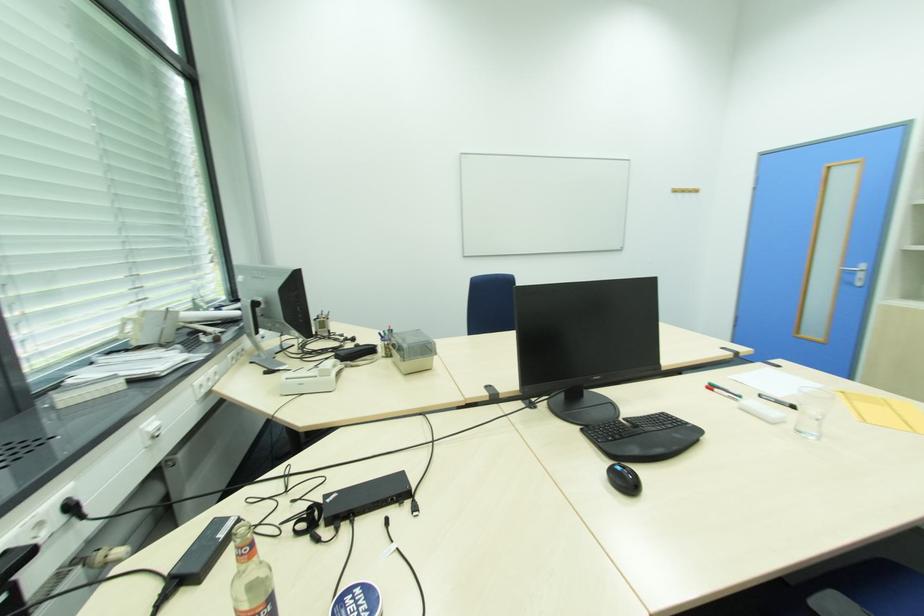
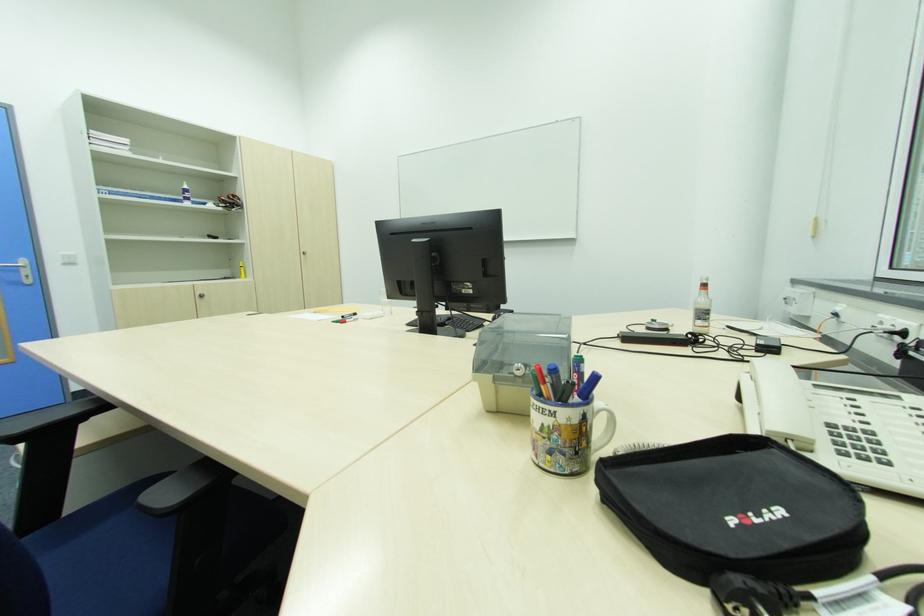
Where in the second image is the point corresponding to [862,285] from the first image?

(30, 282)